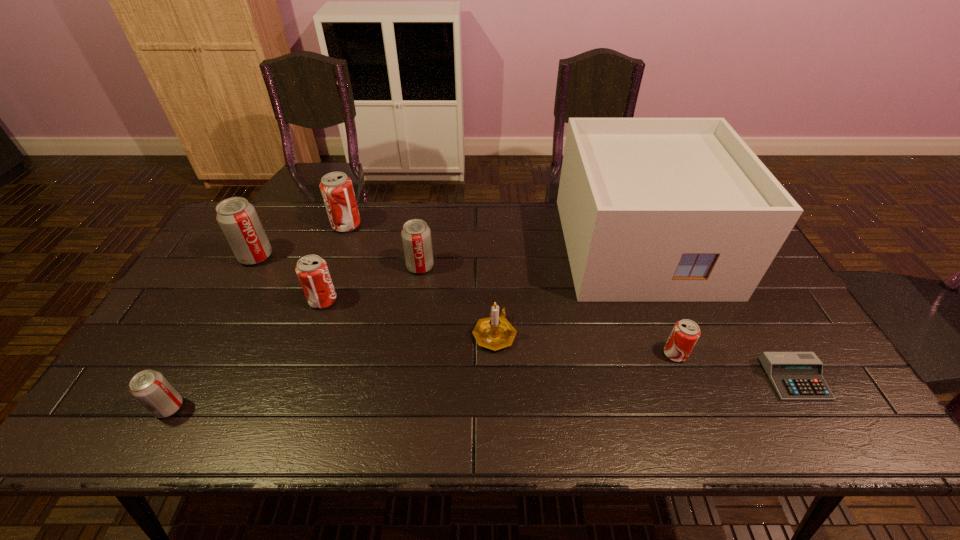
Find the location of a particular element. This screenshot has width=960, height=540. vacant region located on the left of the fifth object from left to right is located at coordinates (305, 266).

The height and width of the screenshot is (540, 960). I want to click on vacant region located on the right of the second biggest pink soda can, so click(x=365, y=300).

Locate an element on the screen. free space located on the front of the sixth object from left to right is located at coordinates (495, 379).

I want to click on vacant region located on the left of the nearest pink soda can, so click(515, 354).

At what (x,y) coordinates should I click in order to perform the action: click on vacant space located 0.240m on the back of the nearest gray soda can. Please return your answer as a coordinate pair (x, y). This screenshot has height=540, width=960. Looking at the image, I should click on (218, 317).

In order to click on vacant area located on the left of the shortest object in this screenshot , I will do `click(720, 379)`.

This screenshot has height=540, width=960. Identify the location of box at the far edge. (652, 209).

This screenshot has height=540, width=960. Identify the location of object that is at the near edge. (150, 388).

The width and height of the screenshot is (960, 540). I want to click on box located in the right edge section of the desktop, so click(x=652, y=209).

Where is `calculator that is at the right edge`? This screenshot has width=960, height=540. calculator that is at the right edge is located at coordinates (796, 376).